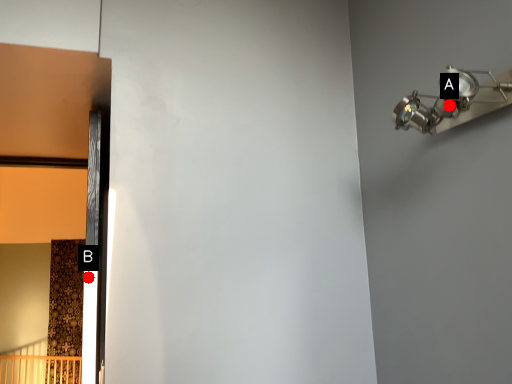
Question: Two points are circled on the image, labeled by A and B beside each circle. Which point is closer to the camera taking this photo?

Choices:
 (A) A is closer
 (B) B is closer

Answer: (A)